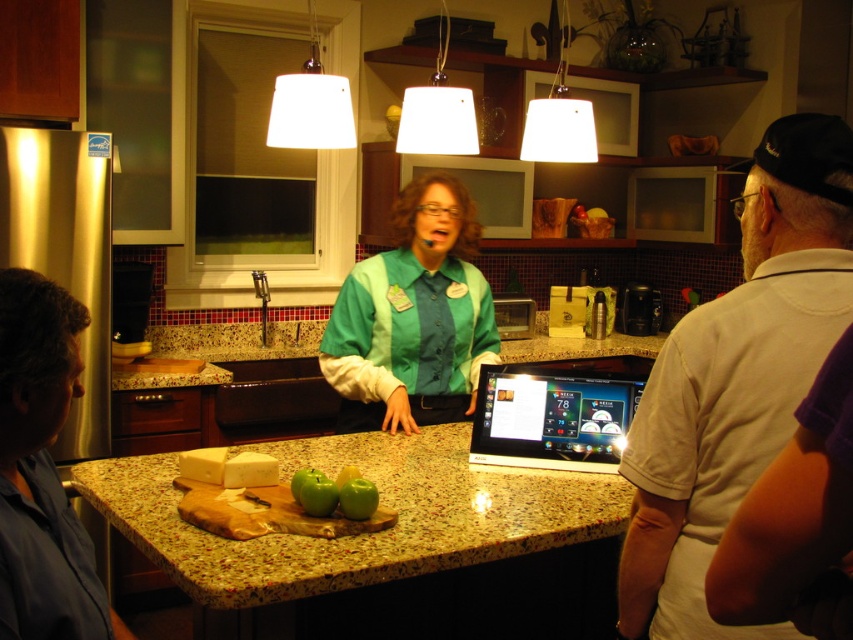
You are a chef standing in front of the speckled granite counter at center and the black glossy tablet at center. Which object is nearer to you?

The speckled granite counter at center is closer to the viewer than the black glossy tablet at center, so the speckled granite counter at center is nearer to you.

You are a photographer setting up a shot in the kitchen scene. You need to place two markers at the coordinates point (641, 561) and point (334, 486). Which marker should you place first to ensure it appears closer to the camera in the final photo?

You should place the marker at point (641, 561) first because it is closer to the camera than point (334, 486) according to the description.

You are a chef standing in the kitchen and need to place a tall vase on the speckled granite counter at center. Considering the height of the green fabric shirt at center, will the vase likely tip over if placed there?

The speckled granite counter at center has a lesser height compared to green fabric shirt at center, so the vase might tip over if placed there since the counter is shorter than the shirt, making it less stable.